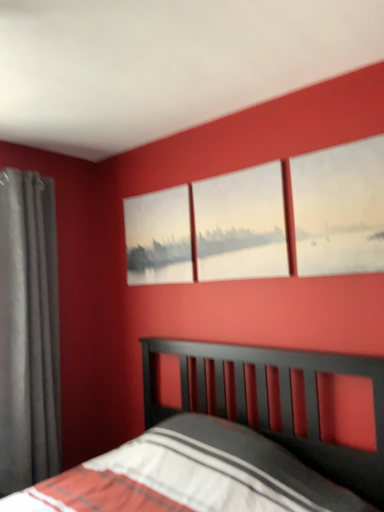
The height and width of the screenshot is (512, 384). Find the location of `matte gray curtain at left`. matte gray curtain at left is located at coordinates pos(28,331).

Where is `white matte painting at center, which appears as the 2th window when viewed from the front`? white matte painting at center, which appears as the 2th window when viewed from the front is located at coordinates 241,224.

From a real-world perspective, is matte canvas painting at center over matte canvas painting at upper right, positioned as the 2th window in left-to-right order?

No.

Which of these two, matte canvas painting at center or matte canvas painting at upper right, acting as the first window starting from the right, is wider?

Wider between the two is matte canvas painting at center.

Would you say matte canvas painting at center contains matte canvas painting at upper right, arranged as the second window when viewed from the back?

No, matte canvas painting at upper right, arranged as the second window when viewed from the back, is located outside of matte canvas painting at center.

Considering the relative positions of matte canvas painting at center and matte canvas painting at upper right, positioned as the 2th window in left-to-right order, in the image provided, is matte canvas painting at center behind matte canvas painting at upper right, positioned as the 2th window in left-to-right order,?

Yes, matte canvas painting at center is further from the camera.

From a real-world perspective, which window is the 2nd one above the matte canvas painting at center? Please provide its 2D coordinates.

[(241, 224)]

From a real-world perspective, relative to matte canvas painting at center, is white matte painting at center, the second window when ordered from right to left, vertically above or below?

white matte painting at center, the second window when ordered from right to left, is situated higher than matte canvas painting at center in the real world.

Who is shorter, white matte painting at center, acting as the first window starting from the back, or matte canvas painting at center?

With less height is matte canvas painting at center.

Consider the image. Is matte canvas painting at center surrounded by white matte painting at center, the second window when ordered from right to left?

Definitely not — matte canvas painting at center is not inside white matte painting at center, the second window when ordered from right to left.

How much distance is there between matte canvas painting at upper right, positioned as the 2th window in left-to-right order, and matte canvas painting at center?

The distance of matte canvas painting at upper right, positioned as the 2th window in left-to-right order, from matte canvas painting at center is 35.15 inches.

Between matte canvas painting at upper right, positioned as the 1th window in front-to-back order, and matte canvas painting at center, which one appears on the left side from the viewer's perspective?

From the viewer's perspective, matte canvas painting at center appears more on the left side.

This screenshot has height=512, width=384. Identify the location of the 2nd window in front of the matte canvas painting at center. (340, 209).

From the image's perspective, which one is positioned lower, matte canvas painting at upper right, acting as the first window starting from the right, or matte canvas painting at center?

matte canvas painting at center.

From a real-world perspective, is matte canvas painting at center physically below matte gray curtain at left?

Actually, matte canvas painting at center is physically above matte gray curtain at left in the real world.

Consider the image. Is matte gray curtain at left at the back of matte canvas painting at center?

matte canvas painting at center does not have its back to matte gray curtain at left.

Is matte canvas painting at center closer to camera compared to matte gray curtain at left?

No, matte canvas painting at center is further to the viewer.

Which is farther from the camera, (26,221) or (161,238)?

The point (161,238) is farther from the camera.

From a real-world perspective, is matte gray curtain at left positioned under matte canvas painting at center based on gravity?

Yes, from a real-world perspective, matte gray curtain at left is below matte canvas painting at center.

At what (x,y) coordinates should I click in order to perform the action: click on picture frame lying above the matte gray curtain at left (from the image's perspective). Please return your answer as a coordinate pair (x, y). The image size is (384, 512). Looking at the image, I should click on (158, 237).

Are matte gray curtain at left and matte canvas painting at center located far from each other?

matte gray curtain at left is near matte canvas painting at center, not far away.

From the image's perspective, is matte canvas painting at center under white matte painting at center, placed as the first window when sorted from left to right?

Yes, from the image's perspective, matte canvas painting at center is below white matte painting at center, placed as the first window when sorted from left to right.

Can you confirm if matte canvas painting at center is bigger than white matte painting at center, the second window when ordered from right to left?

No, matte canvas painting at center is not bigger than white matte painting at center, the second window when ordered from right to left.

Is matte canvas painting at center oriented towards white matte painting at center, which appears as the 2th window when viewed from the front?

No, matte canvas painting at center is not aimed at white matte painting at center, which appears as the 2th window when viewed from the front.

How different are the orientations of matte canvas painting at center and white matte painting at center, acting as the first window starting from the back, in degrees?

0.474 degrees separate the facing orientations of matte canvas painting at center and white matte painting at center, acting as the first window starting from the back.

Which point is more distant from viewer, (321, 172) or (52, 267)?

The point (52, 267) is farther from the camera.

Is matte canvas painting at upper right, acting as the first window starting from the right, next to matte gray curtain at left and touching it?

No.

Based on the photo, between matte canvas painting at upper right, positioned as the 2th window in left-to-right order, and matte gray curtain at left, which one appears on the right side from the viewer's perspective?

Answer: matte canvas painting at upper right, positioned as the 2th window in left-to-right order, is more to the right.

From the image's perspective, is matte canvas painting at upper right, positioned as the 1th window in front-to-back order, under matte gray curtain at left?

No, from the image's perspective, matte canvas painting at upper right, positioned as the 1th window in front-to-back order, is not below matte gray curtain at left.

What are the coordinates of `picture frame that is on the left side of matte canvas painting at upper right, positioned as the 1th window in front-to-back order` in the screenshot? It's located at (158, 237).

The height and width of the screenshot is (512, 384). There is a matte canvas painting at center. In order to click on the 1st window above it (from the image's perspective) in this screenshot , I will do coord(241,224).

Estimate the real-world distances between objects in this image. Which object is further from matte canvas painting at center, white matte painting at center, placed as the first window when sorted from left to right, or matte canvas painting at upper right, acting as the first window starting from the right?

Based on the image, matte canvas painting at upper right, acting as the first window starting from the right, appears to be further to matte canvas painting at center.

Which object lies nearer to the anchor point matte canvas painting at upper right, acting as the first window starting from the right, matte canvas painting at center or matte gray curtain at left?

matte canvas painting at center is closer to matte canvas painting at upper right, acting as the first window starting from the right.

Which object lies nearer to the anchor point matte gray curtain at left, matte canvas painting at upper right, positioned as the 1th window in front-to-back order, or matte canvas painting at center?

matte canvas painting at center.

Estimate the real-world distances between objects in this image. Which object is further from matte gray curtain at left, matte canvas painting at upper right, acting as the first window starting from the right, or white matte painting at center, placed as the first window when sorted from left to right?

Among the two, matte canvas painting at upper right, acting as the first window starting from the right, is located further to matte gray curtain at left.

Looking at the image, which one is located closer to matte gray curtain at left, white matte painting at center, which appears as the 2th window when viewed from the front, or matte canvas painting at upper right, acting as the first window starting from the right?

Based on the image, white matte painting at center, which appears as the 2th window when viewed from the front, appears to be nearer to matte gray curtain at left.

When comparing their distances from matte canvas painting at upper right, arranged as the second window when viewed from the back, does matte canvas painting at center or white matte painting at center, acting as the first window starting from the back, seem further?

matte canvas painting at center lies further to matte canvas painting at upper right, arranged as the second window when viewed from the back, than the other object.

Estimate the real-world distances between objects in this image. Which object is closer to white matte painting at center, the second window when ordered from right to left, matte gray curtain at left or matte canvas painting at center?

matte canvas painting at center.

Estimate the real-world distances between objects in this image. Which object is further from white matte painting at center, which appears as the 2th window when viewed from the front, matte canvas painting at upper right, positioned as the 1th window in front-to-back order, or matte canvas painting at center?

matte canvas painting at center.

This screenshot has width=384, height=512. I want to click on window between matte gray curtain at left and matte canvas painting at upper right, positioned as the 1th window in front-to-back order, from left to right, so click(241, 224).

Find the location of a particular element. picture frame between matte gray curtain at left and matte canvas painting at upper right, acting as the first window starting from the right, in the horizontal direction is located at coordinates (158, 237).

At what (x,y) coordinates should I click in order to perform the action: click on window located between matte canvas painting at center and matte canvas painting at upper right, positioned as the 1th window in front-to-back order, in the left-right direction. Please return your answer as a coordinate pair (x, y). Looking at the image, I should click on (241, 224).

At what (x,y) coordinates should I click in order to perform the action: click on picture frame between matte gray curtain at left and white matte painting at center, the second window when ordered from right to left. Please return your answer as a coordinate pair (x, y). This screenshot has width=384, height=512. Looking at the image, I should click on (158, 237).